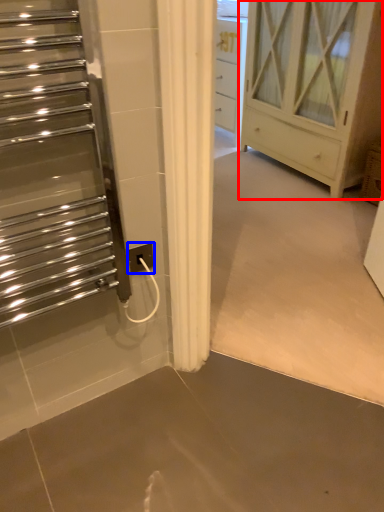
Question: Which point is further to the camera, chest of drawers (highlighted by a red box) or electric outlet (highlighted by a blue box)?

Choices:
 (A) chest of drawers
 (B) electric outlet

Answer: (A)